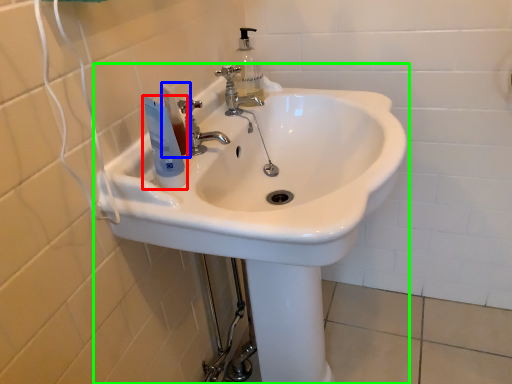
Question: Which is nearer to the mouthwash (highlighted by a red box)? toiletry (highlighted by a blue box) or sink (highlighted by a green box).

Choices:
 (A) toiletry
 (B) sink

Answer: (A)